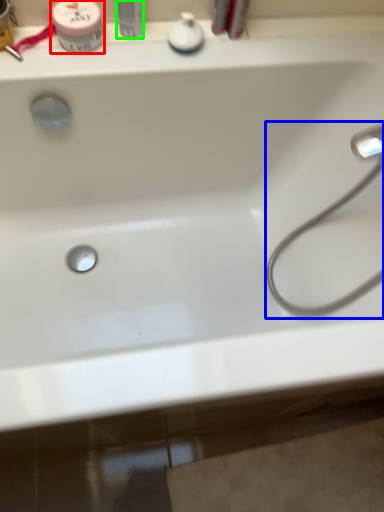
Question: Based on their relative distances, which object is nearer to mouthwash (highlighted by a red box)? Choose from faucet (highlighted by a blue box) and toiletry (highlighted by a green box).

Choices:
 (A) faucet
 (B) toiletry

Answer: (B)